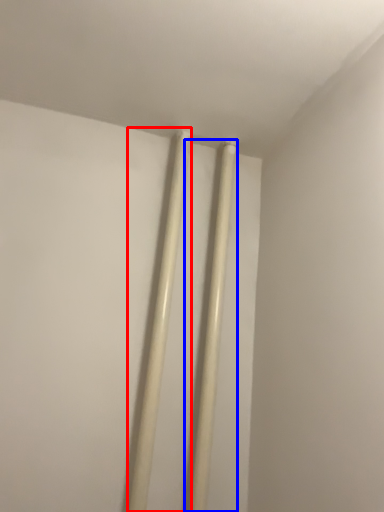
Question: Which object appears farthest to the camera in this image, chopsticks (highlighted by a red box) or beam (highlighted by a blue box)?

Choices:
 (A) chopsticks
 (B) beam

Answer: (B)